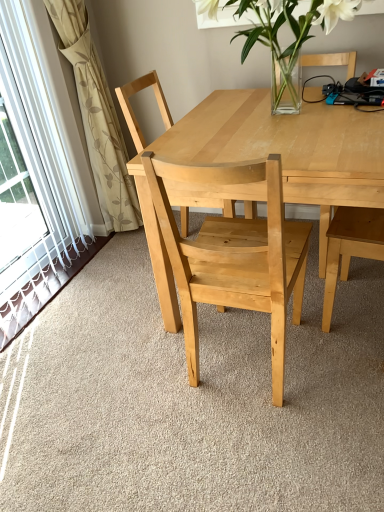
Question: In the image, is beige floral fabric at left positioned in front of or behind clear glass vase at upper center?

Choices:
 (A) behind
 (B) front

Answer: (A)

Question: Is beige floral fabric at left taller or shorter than clear glass vase at upper center?

Choices:
 (A) short
 (B) tall

Answer: (B)

Question: Which object is positioned farthest from the natural wood table at center?

Choices:
 (A) clear glass vase at upper center
 (B) natural wood chair at center, the 1th chair viewed from the front
 (C) beige floral fabric at left
 (D) natural wood chair at center, placed as the first chair when sorted from back to front

Answer: (C)

Question: Considering the real-world distances, which object is farthest from the natural wood chair at center, placed as the first chair when sorted from back to front?

Choices:
 (A) natural wood chair at center, the 1th chair viewed from the front
 (B) natural wood table at center
 (C) beige floral fabric at left
 (D) clear glass vase at upper center

Answer: (A)